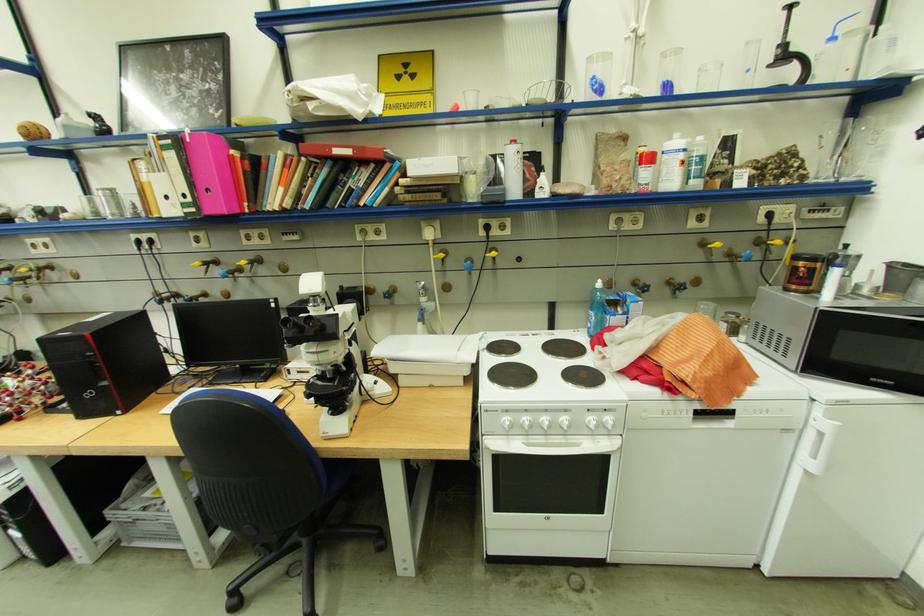
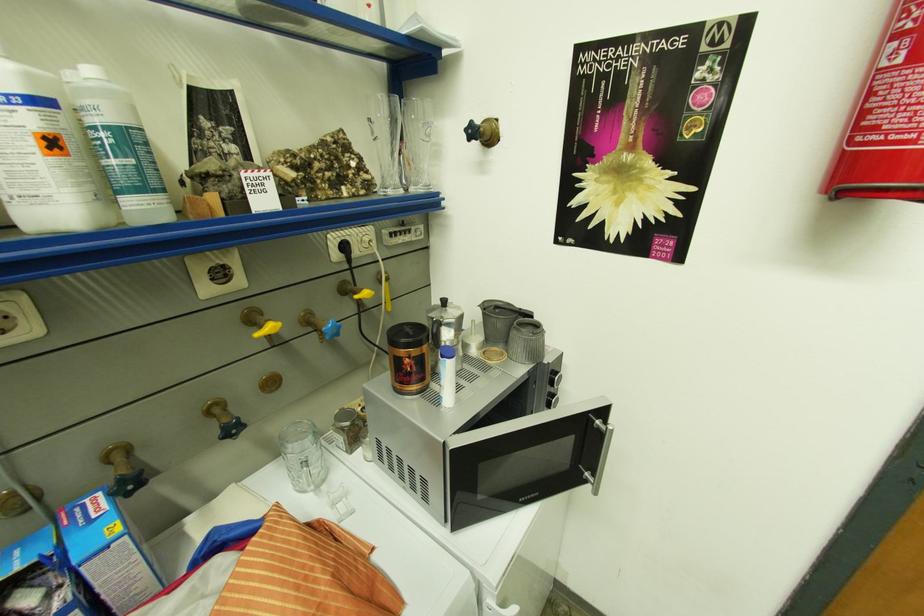
The point at [707,148] is marked in the first image. Where is the corresponding point in the second image?

(98, 103)